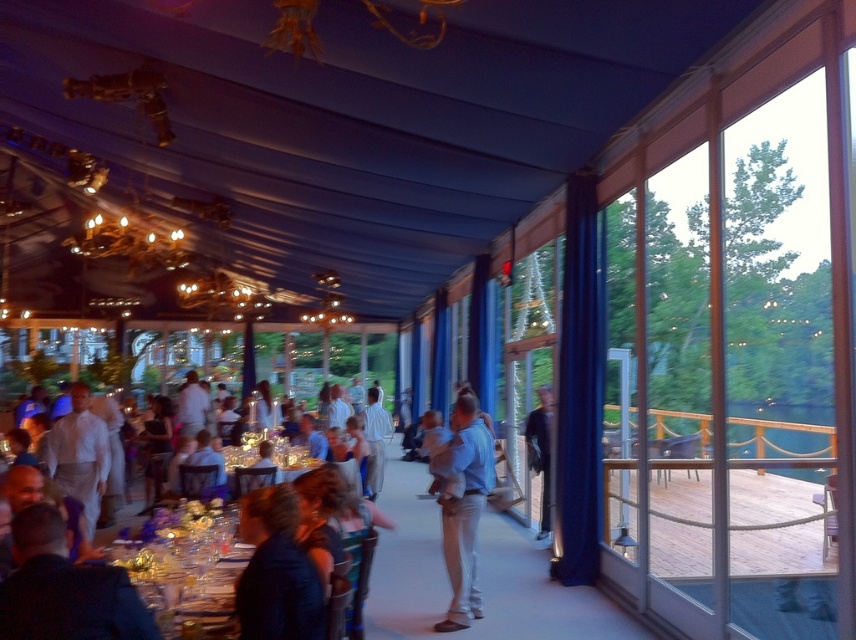
Question: Which point appears farthest from the camera in this image?

Choices:
 (A) (544, 444)
 (B) (78, 416)
 (C) (183, 560)
 (D) (467, 557)

Answer: (A)

Question: Is dark blue fabric at center above blue cotton shirt at center?

Choices:
 (A) yes
 (B) no

Answer: (A)

Question: Which point is farther to the camera?

Choices:
 (A) blue cotton shirt at center
 (B) white cotton shirt at center

Answer: (B)

Question: Does translucent glass table at lower left appear on the left side of dark blue suit at center?

Choices:
 (A) yes
 (B) no

Answer: (A)

Question: Is blue cotton shirt at center smaller than dark blue suit at center?

Choices:
 (A) no
 (B) yes

Answer: (A)

Question: Which object is closer to the camera taking this photo?

Choices:
 (A) dark blue fabric at center
 (B) blue cotton shirt at center
 (C) translucent glass table at lower left
 (D) white cotton shirt at center

Answer: (A)